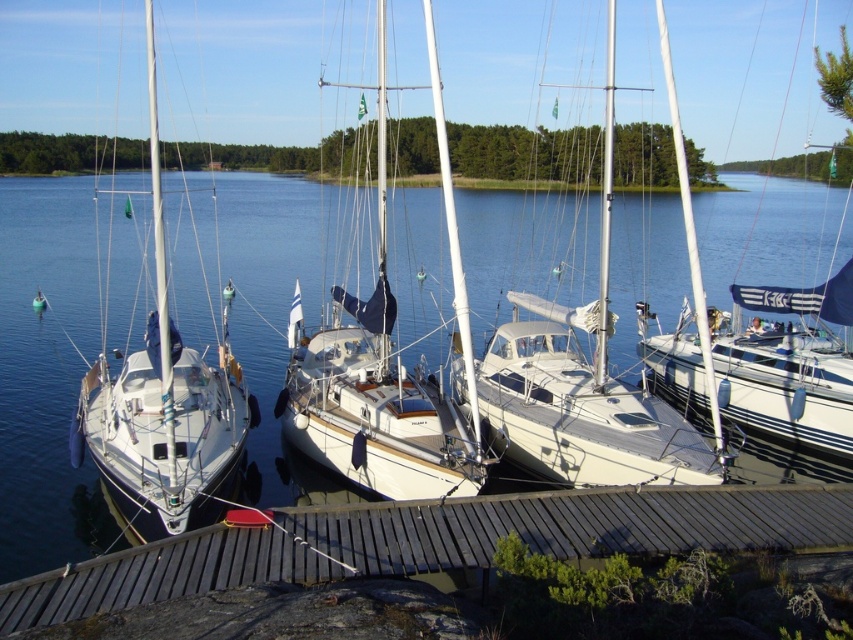
Between clear blue water at center and white matte sailboat at center, which one appears on the left side from the viewer's perspective?

clear blue water at center

Which of these two, clear blue water at center or white matte sailboat at center, stands shorter?

With less height is white matte sailboat at center.

Between point (294, 236) and point (350, 449), which one is positioned in front?

Point (350, 449) is in front.

You are a GUI agent. You are given a task and a screenshot of the screen. Output one action in this format:
    pyautogui.click(x=<x>, y=<y>)
    Task: Click on the clear blue water at center
    Image resolution: width=853 pixels, height=640 pixels.
    Given the screenshot: What is the action you would take?
    pyautogui.click(x=45, y=374)

Can you confirm if clear blue water at center is wider than white glossy sailboat at left?

Yes.

Between clear blue water at center and white glossy sailboat at left, which one is positioned lower?

clear blue water at center

What do you see at coordinates (45, 374) in the screenshot? I see `clear blue water at center` at bounding box center [45, 374].

You are a GUI agent. You are given a task and a screenshot of the screen. Output one action in this format:
    pyautogui.click(x=<x>, y=<y>)
    Task: Click on the clear blue water at center
    The image size is (853, 640).
    Given the screenshot: What is the action you would take?
    pyautogui.click(x=45, y=374)

Does point (581, 552) come closer to viewer compared to point (474, 449)?

Yes.

Can you confirm if wooden dock at lower center is positioned above white matte sailboat at center?

No.

You are a GUI agent. You are given a task and a screenshot of the screen. Output one action in this format:
    pyautogui.click(x=<x>, y=<y>)
    Task: Click on the wooden dock at lower center
    
    Given the screenshot: What is the action you would take?
    pyautogui.click(x=434, y=540)